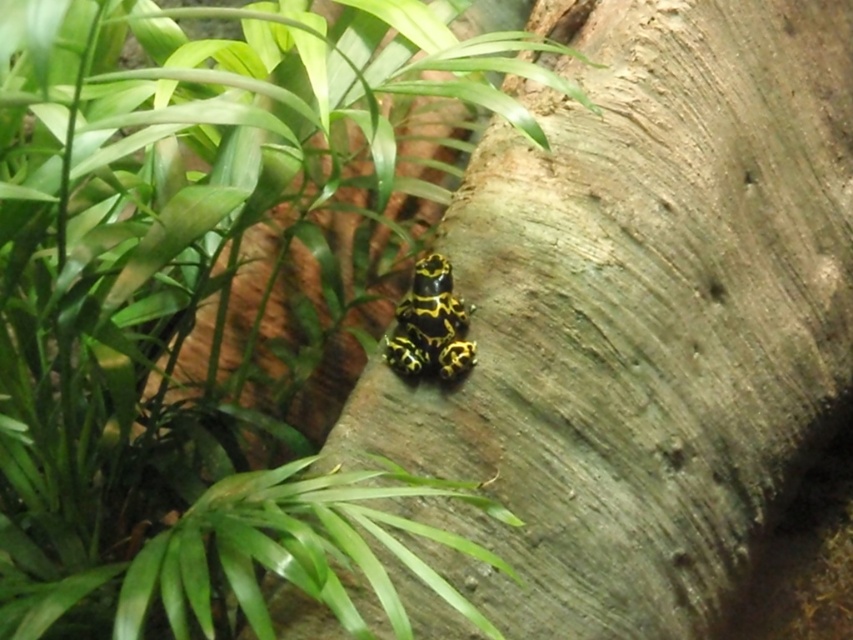
Can you confirm if green leafy plant at center is wider than smooth brown tree trunk at center?

No, green leafy plant at center is not wider than smooth brown tree trunk at center.

Does point (119, 262) come in front of point (735, 404)?

That is True.

At what (x,y) coordinates should I click in order to perform the action: click on green leafy plant at center. Please return your answer as a coordinate pair (x, y). This screenshot has width=853, height=640. Looking at the image, I should click on (207, 298).

Can you confirm if smooth brown tree trunk at center is positioned to the left of yellow-black spotted frog at center?

No, smooth brown tree trunk at center is not to the left of yellow-black spotted frog at center.

Is smooth brown tree trunk at center smaller than yellow-black spotted frog at center?

No, smooth brown tree trunk at center is not smaller than yellow-black spotted frog at center.

At what (x,y) coordinates should I click in order to perform the action: click on smooth brown tree trunk at center. Please return your answer as a coordinate pair (x, y). Image resolution: width=853 pixels, height=640 pixels. Looking at the image, I should click on (637, 314).

At what (x,y) coordinates should I click in order to perform the action: click on smooth brown tree trunk at center. Please return your answer as a coordinate pair (x, y). Image resolution: width=853 pixels, height=640 pixels. Looking at the image, I should click on (637, 314).

Which is more to the right, green leafy plant at center or yellow-black spotted frog at center?

yellow-black spotted frog at center is more to the right.

You are a GUI agent. You are given a task and a screenshot of the screen. Output one action in this format:
    pyautogui.click(x=<x>, y=<y>)
    Task: Click on the green leafy plant at center
    
    Given the screenshot: What is the action you would take?
    pyautogui.click(x=207, y=298)

Which is behind, point (219, 124) or point (424, 333)?

The point (424, 333) is more distant.

Where is `green leafy plant at center`? The height and width of the screenshot is (640, 853). green leafy plant at center is located at coordinates (207, 298).